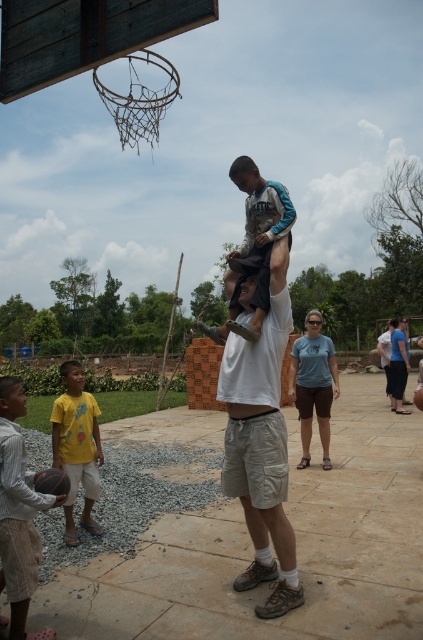
Question: Which point is closer to the camera taking this photo?

Choices:
 (A) (65, 429)
 (B) (208, 326)

Answer: (B)

Question: Which object is positioned farthest from the matte gray shirt at center?

Choices:
 (A) striped cotton shirt at lower left
 (B) rusty wire mesh at upper center
 (C) white cotton t-shirt at center

Answer: (B)

Question: Can you confirm if white cotton t-shirt at center is positioned to the left of striped cotton shirt at lower left?

Choices:
 (A) no
 (B) yes

Answer: (A)

Question: Does matte gray shirt at center have a smaller size compared to rubber textured basketball at lower left?

Choices:
 (A) no
 (B) yes

Answer: (A)

Question: Among these objects, which one is farthest from the camera?

Choices:
 (A) white cotton t-shirt at center
 (B) striped cotton shirt at lower left

Answer: (A)

Question: Is white cotton t-shirt at center positioned at the back of blue cotton shirt at center?

Choices:
 (A) yes
 (B) no

Answer: (B)